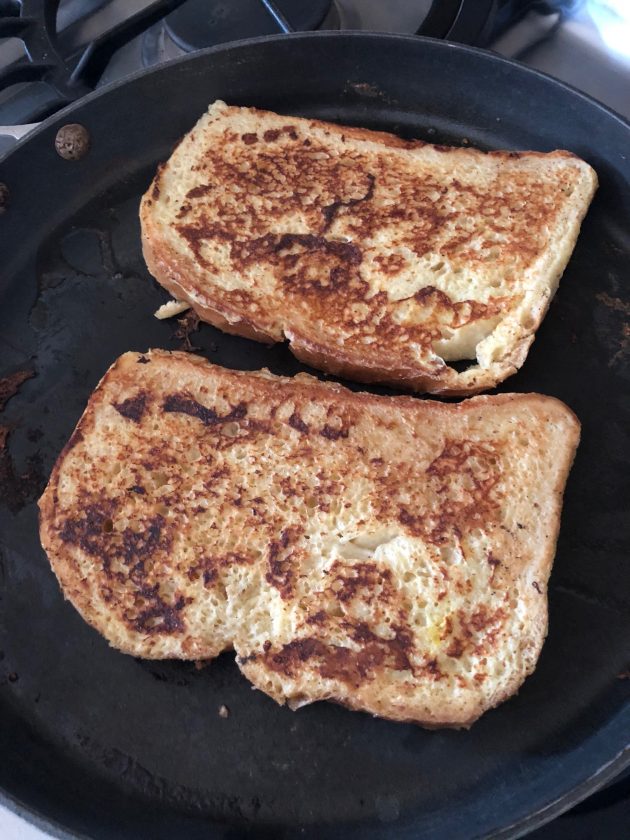
In order to click on stove top in this screenshot , I will do `click(581, 70)`.